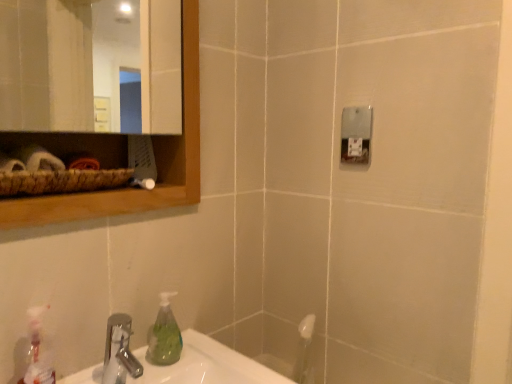
Question: Is silver metallic faucet at lower left far from translucent plastic spray bottle at lower left?

Choices:
 (A) yes
 (B) no

Answer: (B)

Question: Considering the relative positions of silver metallic faucet at lower left and translucent plastic spray bottle at lower left in the image provided, is silver metallic faucet at lower left to the right of translucent plastic spray bottle at lower left from the viewer's perspective?

Choices:
 (A) yes
 (B) no

Answer: (A)

Question: Does silver metallic faucet at lower left contain translucent plastic spray bottle at lower left?

Choices:
 (A) yes
 (B) no

Answer: (B)

Question: Considering the relative sizes of silver metallic faucet at lower left and translucent plastic spray bottle at lower left in the image provided, is silver metallic faucet at lower left smaller than translucent plastic spray bottle at lower left?

Choices:
 (A) yes
 (B) no

Answer: (B)

Question: Considering the relative sizes of silver metallic faucet at lower left and translucent plastic spray bottle at lower left in the image provided, is silver metallic faucet at lower left taller than translucent plastic spray bottle at lower left?

Choices:
 (A) yes
 (B) no

Answer: (B)

Question: Is silver metallic faucet at lower left next to translucent plastic spray bottle at lower left and touching it?

Choices:
 (A) no
 (B) yes

Answer: (A)

Question: Considering the relative sizes of translucent plastic spray bottle at lower left and wooden mirror at upper left in the image provided, is translucent plastic spray bottle at lower left smaller than wooden mirror at upper left?

Choices:
 (A) no
 (B) yes

Answer: (B)

Question: Is translucent plastic spray bottle at lower left to the right of wooden mirror at upper left from the viewer's perspective?

Choices:
 (A) yes
 (B) no

Answer: (B)

Question: Would you say translucent plastic spray bottle at lower left is a long distance from wooden mirror at upper left?

Choices:
 (A) no
 (B) yes

Answer: (B)

Question: From a real-world perspective, does translucent plastic spray bottle at lower left stand above wooden mirror at upper left?

Choices:
 (A) yes
 (B) no

Answer: (B)

Question: Is translucent plastic spray bottle at lower left aimed at wooden mirror at upper left?

Choices:
 (A) yes
 (B) no

Answer: (B)

Question: Is translucent plastic spray bottle at lower left completely or partially outside of wooden mirror at upper left?

Choices:
 (A) yes
 (B) no

Answer: (A)

Question: Does wooden mirror at upper left have a larger size compared to translucent plastic spray bottle at lower left?

Choices:
 (A) no
 (B) yes

Answer: (B)